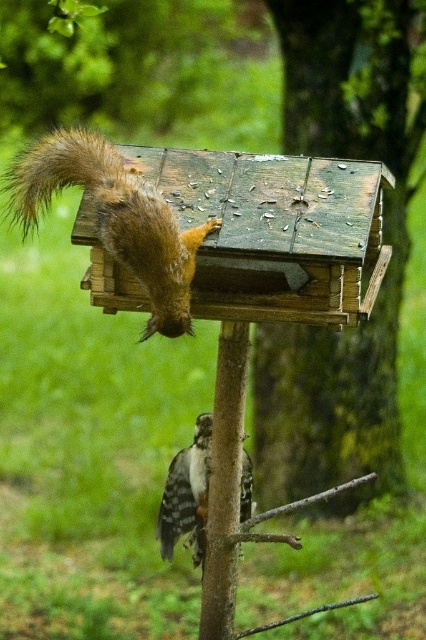
You are a photographer trying to capture both the weathered wood birdhouse at center and the speckled brown woodpecker at lower center in a single shot. Which object should you focus on first to ensure both are in clear view?

You should focus on the weathered wood birdhouse at center first because it is closer to you than the speckled brown woodpecker at lower center, ensuring both are in focus when focusing on the nearer object.